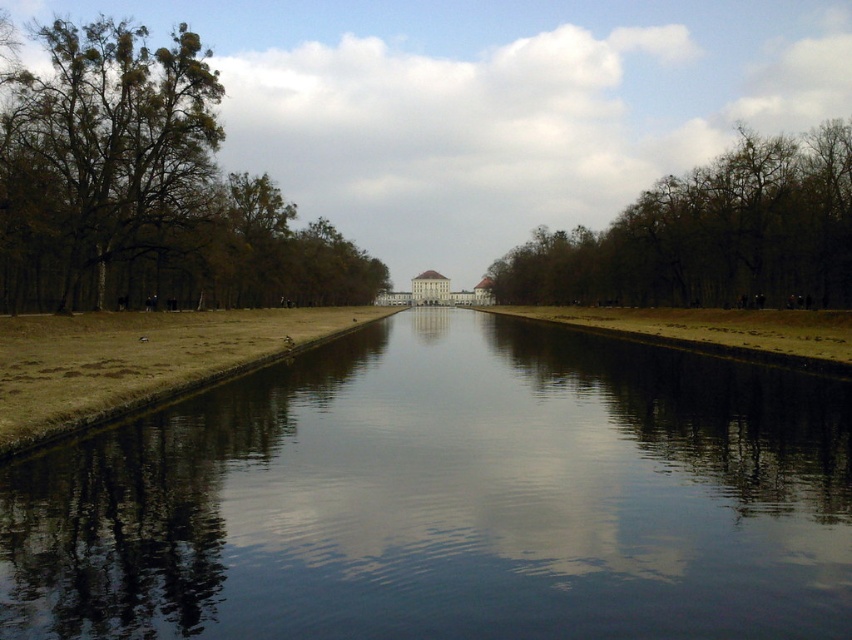
Question: In this image, where is smooth reflective water at center located relative to brown leafless trees at center?

Choices:
 (A) right
 (B) left

Answer: (B)

Question: Which point is closer to the camera?

Choices:
 (A) brown leafless trees at center
 (B) smooth reflective water at center

Answer: (B)

Question: Which of the following is the closest to the observer?

Choices:
 (A) smooth reflective water at center
 (B) green leafy tree at left
 (C) brown leafless trees at center

Answer: (A)

Question: Can you confirm if smooth reflective water at center is positioned above green leafy tree at left?

Choices:
 (A) yes
 (B) no

Answer: (B)

Question: Is green leafy tree at left smaller than brown leafless trees at center?

Choices:
 (A) yes
 (B) no

Answer: (B)

Question: Which of the following is the farthest from the observer?

Choices:
 (A) (605, 568)
 (B) (517, 259)

Answer: (B)